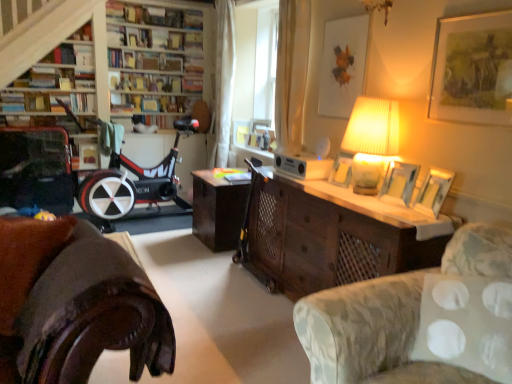
Identify the location of free space that is to the left of wooden picture frame at right, arranged as the fourth picture frame when viewed from the back. The height and width of the screenshot is (384, 512). (398, 212).